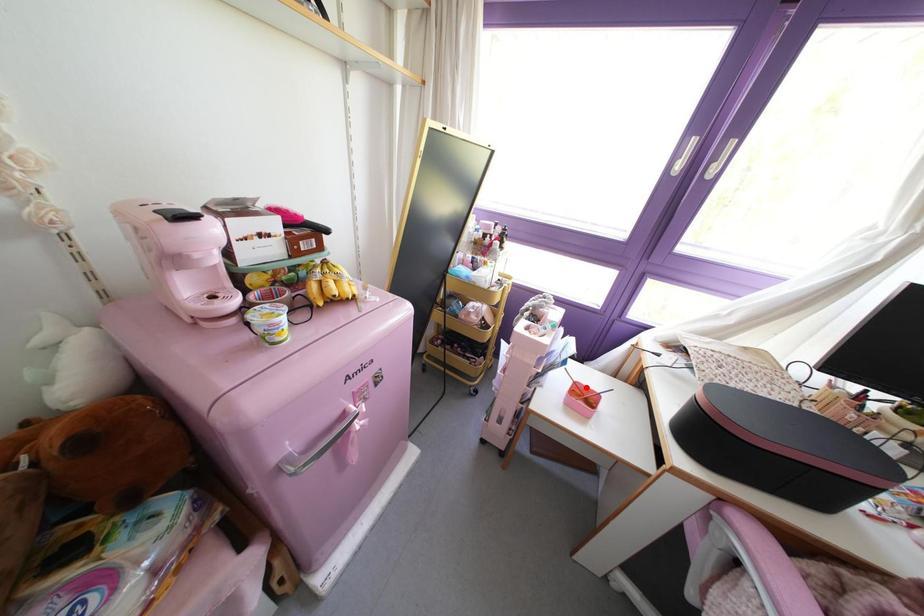
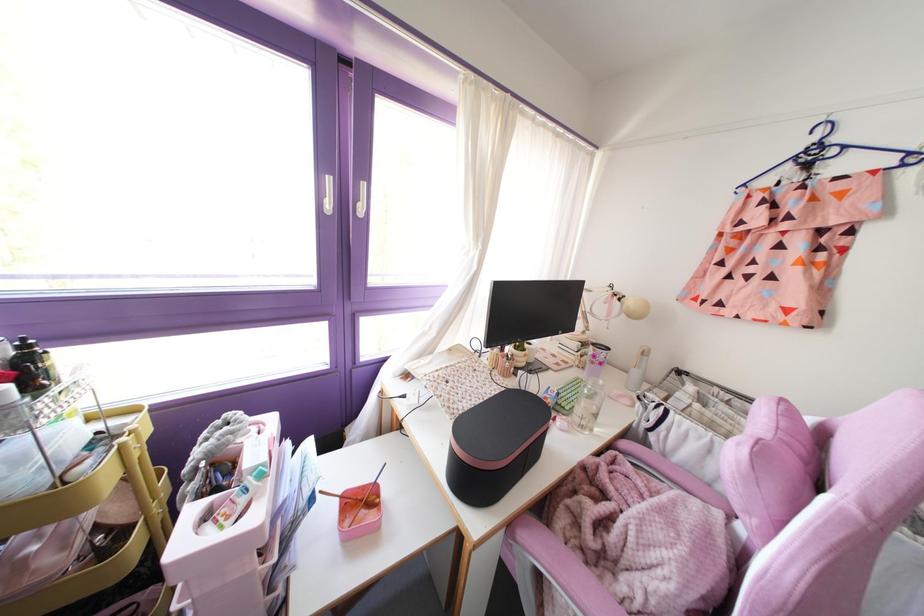
Question: I am providing you with two images of the same scene from different viewpoints. A red point is shown in image1. For the corresponding object point in image2, is it positioned nearer or farther from the camera?

Choices:
 (A) Nearer
 (B) Farther

Answer: (A)